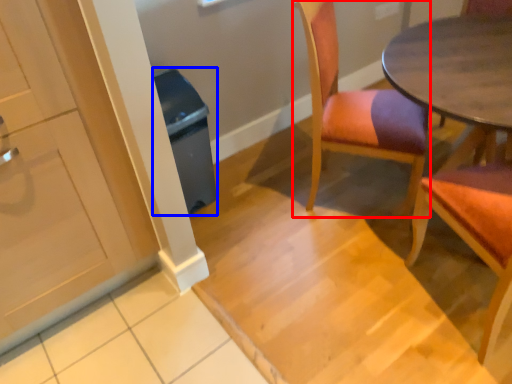
Question: Which object is closer to the camera taking this photo, chair (highlighted by a red box) or trash bin/can (highlighted by a blue box)?

Choices:
 (A) chair
 (B) trash bin/can

Answer: (A)